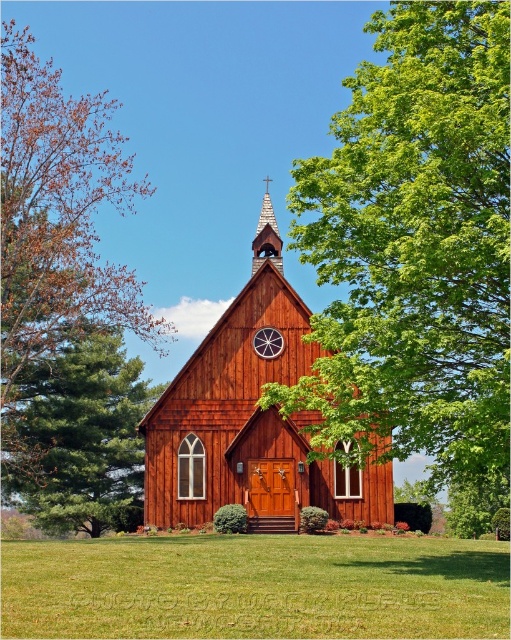
Question: Which object is positioned farthest from the green leafy tree at center?

Choices:
 (A) wooden church at center
 (B) wooden spire at upper center
 (C) green pine tree at lower left
 (D) brown wood tree at left

Answer: (B)

Question: Is green leafy tree at center smaller than wooden clock at center?

Choices:
 (A) no
 (B) yes

Answer: (A)

Question: Which point appears farthest from the camera in this image?

Choices:
 (A) (276, 244)
 (B) (473, 257)
 (C) (297, 422)
 (D) (87, 262)

Answer: (D)

Question: Does green leafy tree at center appear over wooden church at center?

Choices:
 (A) no
 (B) yes

Answer: (B)

Question: Which of the following is the closest to the observer?

Choices:
 (A) wooden spire at upper center
 (B) green pine tree at lower left

Answer: (A)

Question: Does wooden church at center have a lesser width compared to wooden clock at center?

Choices:
 (A) no
 (B) yes

Answer: (A)